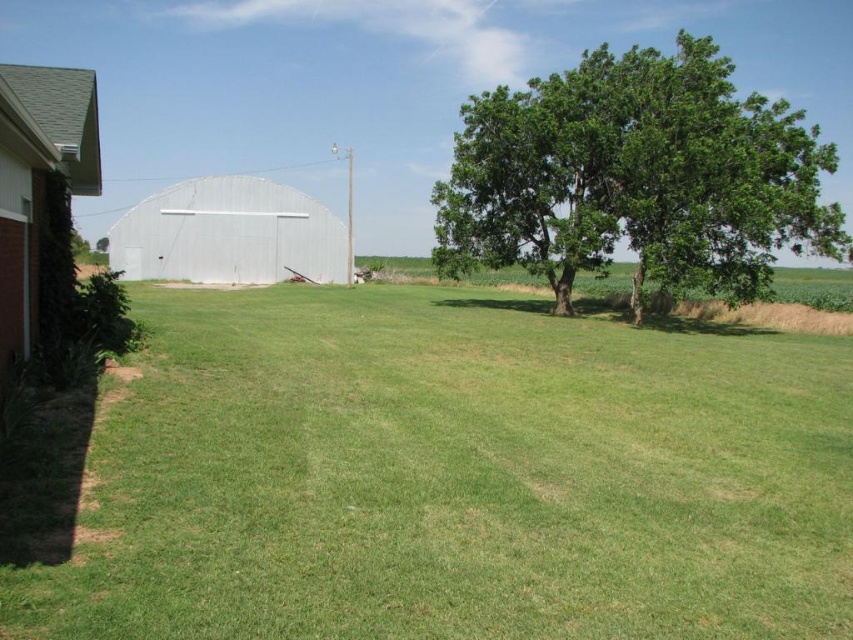
You are planning to install a new satellite dish on the tallest object in the scene. Which object should you choose between the green leafy tree at upper right and the white metallic barn at center?

The green leafy tree at upper right is taller than the white metallic barn at center, so you should install the satellite dish on the green leafy tree at upper right.